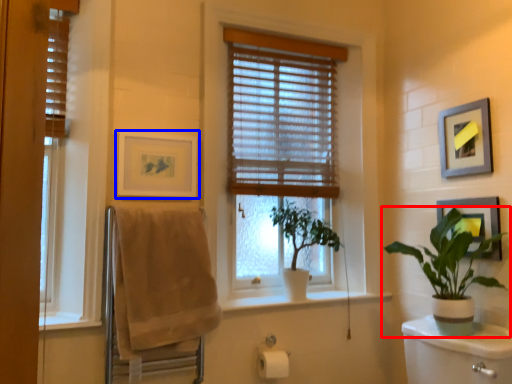
Question: Among these objects, which one is farthest to the camera, houseplant (highlighted by a red box) or picture frame (highlighted by a blue box)?

Choices:
 (A) houseplant
 (B) picture frame

Answer: (B)